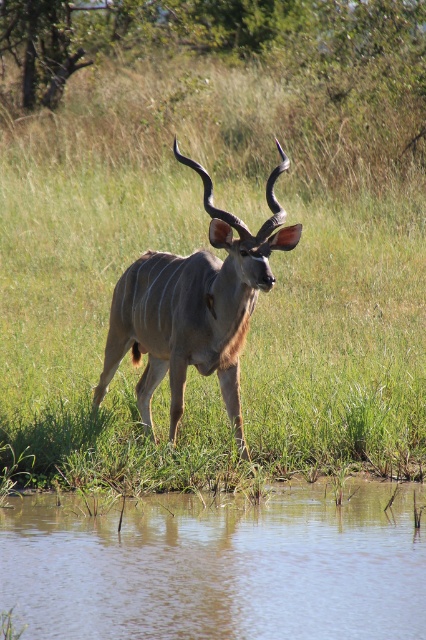
You are a photographer trying to capture the kudu in the image. To ensure the green grass at center is in focus, where should you aim your camera?

You should aim your camera at point [207,246] to focus on the green grass at center.

You are a wildlife photographer aiming to capture a clear photo of the kudu. You are currently standing at the camera position. Is the brown muddy water at lower center within your shooting range if your camera has a minimum focusing distance of 15 feet?

The brown muddy water at lower center and camera are 14.49 feet apart, which is within the camera minimum focusing distance of 15 feet. Therefore, the brown muddy water at lower center is within the shooting range.